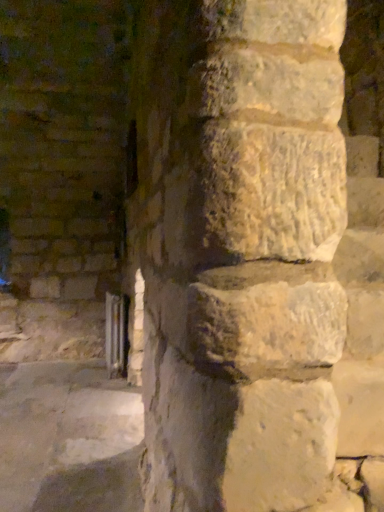
Question: Should I look upward or downward to see clear glass window at lower left?

Choices:
 (A) up
 (B) down

Answer: (B)